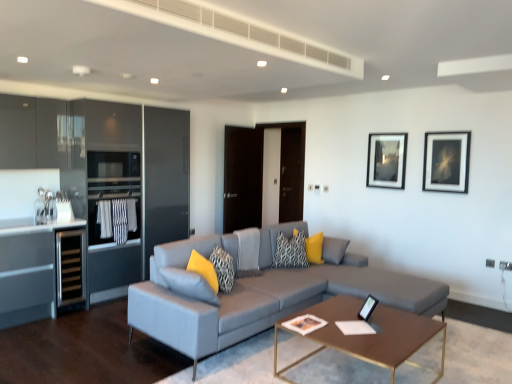
What is the approximate width of patterned fabric pillow at center, positioned as the second pillow in back-to-front order?

patterned fabric pillow at center, positioned as the second pillow in back-to-front order, is 8.52 inches in width.

The height and width of the screenshot is (384, 512). What do you see at coordinates (257, 294) in the screenshot? I see `textured gray couch at center` at bounding box center [257, 294].

This screenshot has width=512, height=384. What do you see at coordinates (290, 169) in the screenshot?
I see `transparent glass door at center` at bounding box center [290, 169].

The height and width of the screenshot is (384, 512). Identify the location of transparent glass door at center. (290, 169).

Measure the distance between black stainless steel wine cooler at left and camera.

They are 3.76 meters apart.

This screenshot has width=512, height=384. What do you see at coordinates (42, 271) in the screenshot?
I see `black stainless steel wine cooler at left` at bounding box center [42, 271].

Find the location of a particular element. Image resolution: width=512 pixels, height=384 pixels. brown metallic coffee table at center is located at coordinates (368, 335).

What do you see at coordinates (368, 335) in the screenshot?
I see `brown metallic coffee table at center` at bounding box center [368, 335].

This screenshot has width=512, height=384. I want to click on matte black picture frame at upper center, the 2th picture frame from the right, so click(386, 160).

Where is `patterned fabric pillow at center, the 2th pillow when ordered from right to left`? The width and height of the screenshot is (512, 384). patterned fabric pillow at center, the 2th pillow when ordered from right to left is located at coordinates (290, 251).

You are a GUI agent. You are given a task and a screenshot of the screen. Output one action in this format:
    pyautogui.click(x=<x>, y=<y>)
    Task: Click on the coffee table on the right of patterned fabric pillow at center, placed as the third pillow when sorted from left to right
    
    Given the screenshot: What is the action you would take?
    pyautogui.click(x=368, y=335)

Is patterned fabric pillow at center, positioned as the second pillow in back-to-front order, closer to the viewer compared to brown metallic coffee table at center?

No, patterned fabric pillow at center, positioned as the second pillow in back-to-front order, is further to the viewer.

Considering the relative sizes of patterned fabric pillow at center, placed as the third pillow when sorted from left to right, and brown metallic coffee table at center in the image provided, is patterned fabric pillow at center, placed as the third pillow when sorted from left to right, smaller than brown metallic coffee table at center?

Correct, patterned fabric pillow at center, placed as the third pillow when sorted from left to right, occupies less space than brown metallic coffee table at center.

Can you tell me how much yellow fabric pillow at lower center, which ranks as the first pillow in front-to-back order, and textured gray pillow at center, arranged as the third pillow when viewed from the right, differ in facing direction?

The angle between the facing direction of yellow fabric pillow at lower center, which ranks as the first pillow in front-to-back order, and the facing direction of textured gray pillow at center, arranged as the third pillow when viewed from the right, is 0.0113 degrees.

Could you tell me if yellow fabric pillow at lower center, acting as the 1th pillow starting from the left, is facing textured gray pillow at center, positioned as the 2th pillow in front-to-back order?

Yes, yellow fabric pillow at lower center, acting as the 1th pillow starting from the left, faces towards textured gray pillow at center, positioned as the 2th pillow in front-to-back order.

The height and width of the screenshot is (384, 512). I want to click on pillow lying below the textured gray pillow at center, the second pillow from the left (from the image's perspective), so click(x=203, y=269).

How much distance is there between yellow fabric pillow at lower center, acting as the 1th pillow starting from the left, and textured gray pillow at center, positioned as the 2th pillow in front-to-back order?

yellow fabric pillow at lower center, acting as the 1th pillow starting from the left, is 7.46 inches from textured gray pillow at center, positioned as the 2th pillow in front-to-back order.

Which of these two, matte black picture frame at upper center, the 2th picture frame from the right, or black stainless steel wine cooler at left, is thinner?

Thinner between the two is matte black picture frame at upper center, the 2th picture frame from the right.

Does matte black picture frame at upper center, placed as the 2th picture frame when sorted from front to back, have a smaller size compared to black stainless steel wine cooler at left?

Indeed, matte black picture frame at upper center, placed as the 2th picture frame when sorted from front to back, has a smaller size compared to black stainless steel wine cooler at left.

Locate an element on the screen. This screenshot has width=512, height=384. cabinetry beneath the matte black picture frame at upper center, placed as the 2th picture frame when sorted from front to back (from a real-world perspective) is located at coordinates (42, 271).

Would you consider matte black picture frame at upper center, the 2th picture frame from the right, to be distant from black stainless steel wine cooler at left?

Yes, matte black picture frame at upper center, the 2th picture frame from the right, and black stainless steel wine cooler at left are located far from each other.

From the image's perspective, is matte black picture frame at upper center, the first picture frame in the back-to-front sequence, beneath textured gray pillow at center, positioned as the 2th pillow in front-to-back order?

Incorrect, from the image's perspective, matte black picture frame at upper center, the first picture frame in the back-to-front sequence, is higher than textured gray pillow at center, positioned as the 2th pillow in front-to-back order.

Can we say matte black picture frame at upper center, which appears as the 1th picture frame when viewed from the left, lies outside textured gray pillow at center, arranged as the third pillow when viewed from the right?

Yes, matte black picture frame at upper center, which appears as the 1th picture frame when viewed from the left, is outside of textured gray pillow at center, arranged as the third pillow when viewed from the right.

Who is taller, matte black picture frame at upper center, the 2th picture frame from the right, or textured gray pillow at center, positioned as the 2th pillow in front-to-back order?

matte black picture frame at upper center, the 2th picture frame from the right, is taller.

Which of these two, matte black picture frame at upper center, which appears as the 1th picture frame when viewed from the left, or textured gray pillow at center, the second pillow from the left, is thinner?

With smaller width is matte black picture frame at upper center, which appears as the 1th picture frame when viewed from the left.

Which is behind, point (382, 141) or point (324, 340)?

Point (382, 141)

Would you say brown metallic coffee table at center is part of matte black picture frame at upper center, the 2th picture frame from the right,'s contents?

Actually, brown metallic coffee table at center is outside matte black picture frame at upper center, the 2th picture frame from the right.

Can you confirm if matte black picture frame at upper center, which appears as the 1th picture frame when viewed from the left, is smaller than brown metallic coffee table at center?

Indeed, matte black picture frame at upper center, which appears as the 1th picture frame when viewed from the left, has a smaller size compared to brown metallic coffee table at center.

Which is farther, (298,251) or (439,147)?

The point (439,147) is more distant.

From a real-world perspective, who is located lower, patterned fabric pillow at center, positioned as the second pillow in back-to-front order, or matte black picture frame at upper right, which ranks as the second picture frame in left-to-right order?

From a 3D spatial view, patterned fabric pillow at center, positioned as the second pillow in back-to-front order, is below.

Considering the relative positions of patterned fabric pillow at center, positioned as the second pillow in back-to-front order, and matte black picture frame at upper right, which ranks as the second picture frame in left-to-right order, in the image provided, is patterned fabric pillow at center, positioned as the second pillow in back-to-front order, to the left of matte black picture frame at upper right, which ranks as the second picture frame in left-to-right order, from the viewer's perspective?

Correct, you'll find patterned fabric pillow at center, positioned as the second pillow in back-to-front order, to the left of matte black picture frame at upper right, which ranks as the second picture frame in left-to-right order.

Can you confirm if patterned fabric pillow at center, the third pillow viewed from the front, is taller than matte black picture frame at upper right, which ranks as the second picture frame in left-to-right order?

No.

Looking at the image, does patterned fabric pillow at center, positioned as the second pillow in back-to-front order, seem bigger or smaller compared to transparent glass door at center?

patterned fabric pillow at center, positioned as the second pillow in back-to-front order, is smaller than transparent glass door at center.

Consider the image. Are patterned fabric pillow at center, positioned as the second pillow in back-to-front order, and transparent glass door at center making contact?

patterned fabric pillow at center, positioned as the second pillow in back-to-front order, and transparent glass door at center are not in contact.

Consider the image. Considering the sizes of patterned fabric pillow at center, placed as the third pillow when sorted from left to right, and transparent glass door at center in the image, is patterned fabric pillow at center, placed as the third pillow when sorted from left to right, taller or shorter than transparent glass door at center?

patterned fabric pillow at center, placed as the third pillow when sorted from left to right, is shorter than transparent glass door at center.

Locate an element on the screen. pillow that is the 4th one above the brown metallic coffee table at center (from a real-world perspective) is located at coordinates (290, 251).

This screenshot has width=512, height=384. In order to click on pillow that is the 1st object located behind the yellow fabric pillow at lower center, acting as the 1th pillow starting from the left in this screenshot , I will do `click(223, 268)`.

From the image, which object appears to be nearer to matte black picture frame at upper center, which appears as the 1th picture frame when viewed from the left, patterned fabric pillow at center, the third pillow viewed from the front, or yellow fabric pillow at center, which is counted as the first pillow, starting from the back?

Among the two, yellow fabric pillow at center, which is counted as the first pillow, starting from the back, is located nearer to matte black picture frame at upper center, which appears as the 1th picture frame when viewed from the left.

Based on the photo, which object lies nearer to the anchor point matte black picture frame at upper center, the first picture frame in the back-to-front sequence, textured gray couch at center or yellow fabric pillow at center, which is counted as the first pillow, starting from the back?

yellow fabric pillow at center, which is counted as the first pillow, starting from the back, is closer to matte black picture frame at upper center, the first picture frame in the back-to-front sequence.

Considering their positions, is textured gray couch at center positioned closer to transparent glass door at center than patterned fabric pillow at center, the third pillow viewed from the front?

The object closer to transparent glass door at center is patterned fabric pillow at center, the third pillow viewed from the front.

When comparing their distances from textured gray pillow at center, which ranks as the 3th pillow in back-to-front order, does yellow fabric pillow at center, the fourth pillow positioned from the front, or transparent glass door at center seem closer?

yellow fabric pillow at center, the fourth pillow positioned from the front, is closer to textured gray pillow at center, which ranks as the 3th pillow in back-to-front order.

Looking at the image, which one is located further to textured gray couch at center, yellow fabric pillow at center, which is counted as the first pillow, starting from the back, or patterned fabric pillow at center, placed as the third pillow when sorted from left to right?

Among the two, yellow fabric pillow at center, which is counted as the first pillow, starting from the back, is located further to textured gray couch at center.

Based on the photo, considering their positions, is matte black picture frame at upper center, placed as the 2th picture frame when sorted from front to back, positioned closer to textured gray couch at center than matte black picture frame at upper right, which is the first picture frame from right to left?

matte black picture frame at upper center, placed as the 2th picture frame when sorted from front to back, lies closer to textured gray couch at center than the other object.

Estimate the real-world distances between objects in this image. Which object is closer to matte black picture frame at upper center, the first picture frame in the back-to-front sequence, yellow fabric pillow at center, which is counted as the first pillow, starting from the back, or matte black picture frame at upper right, positioned as the first picture frame in front-to-back order?

matte black picture frame at upper right, positioned as the first picture frame in front-to-back order, is closer to matte black picture frame at upper center, the first picture frame in the back-to-front sequence.

Which object lies further to the anchor point matte black picture frame at upper center, the 2th picture frame from the right, matte black picture frame at upper right, which ranks as the second picture frame in left-to-right order, or yellow fabric pillow at center, arranged as the fourth pillow when viewed from the left?

Among the two, yellow fabric pillow at center, arranged as the fourth pillow when viewed from the left, is located further to matte black picture frame at upper center, the 2th picture frame from the right.

This screenshot has height=384, width=512. I want to click on pillow between textured gray couch at center and textured gray pillow at center, positioned as the 2th pillow in front-to-back order, along the z-axis, so click(203, 269).

Where is `pillow between patterned fabric pillow at center, positioned as the second pillow in back-to-front order, and transparent glass door at center from front to back`? pillow between patterned fabric pillow at center, positioned as the second pillow in back-to-front order, and transparent glass door at center from front to back is located at coordinates (314, 248).

Where is `studio couch located between brown metallic coffee table at center and transparent glass door at center in the depth direction`? This screenshot has width=512, height=384. studio couch located between brown metallic coffee table at center and transparent glass door at center in the depth direction is located at coordinates (257, 294).

You are a GUI agent. You are given a task and a screenshot of the screen. Output one action in this format:
    pyautogui.click(x=<x>, y=<y>)
    Task: Click on the picture frame situated between patterned fabric pillow at center, placed as the third pillow when sorted from left to right, and matte black picture frame at upper right, which is the first picture frame from right to left, from left to right
    The width and height of the screenshot is (512, 384).
    Given the screenshot: What is the action you would take?
    pyautogui.click(x=386, y=160)